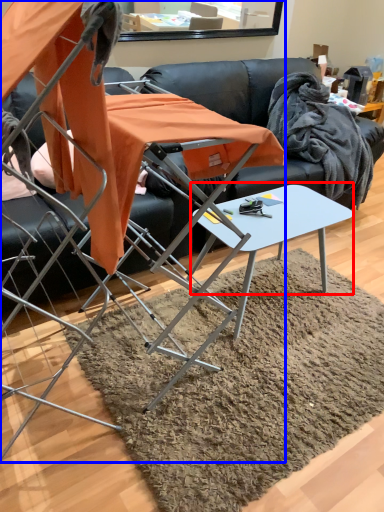
Question: Among these objects, which one is nearest to the camera, round table (highlighted by a red box) or chair (highlighted by a blue box)?

Choices:
 (A) round table
 (B) chair

Answer: (B)